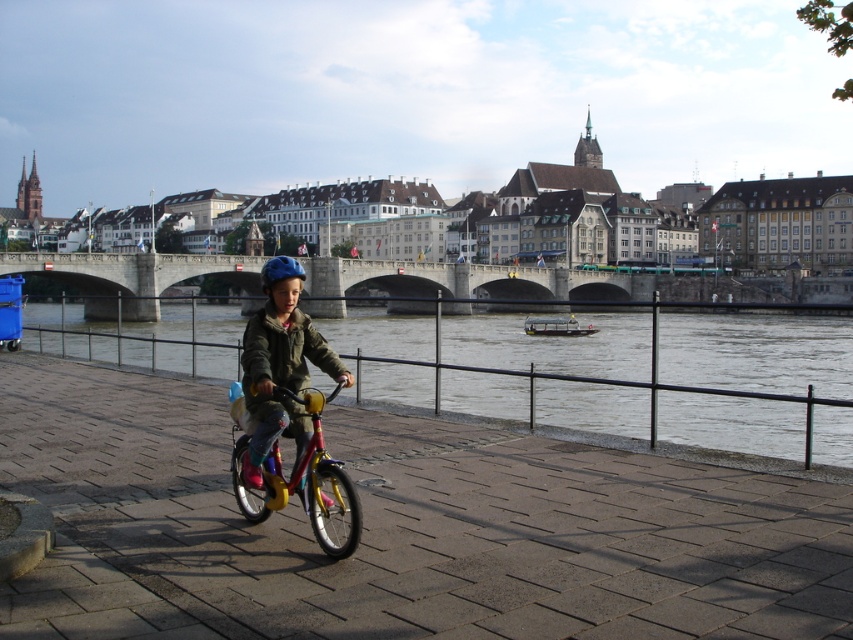
I want to click on stone bridge at center, so click(471, 285).

Who is more forward, (560, 294) or (270, 461)?

Positioned in front is point (270, 461).

Identify the location of stone bridge at center. This screenshot has width=853, height=640. (471, 285).

Consider the image. Is stone bridge at center wider than blue matte helmet at center?

Correct, the width of stone bridge at center exceeds that of blue matte helmet at center.

Is point (375, 275) farther from viewer compared to point (264, 289)?

Yes, point (375, 275) is farther from viewer.

Identify the location of stone bridge at center. Image resolution: width=853 pixels, height=640 pixels. (471, 285).

Who is positioned more to the left, smooth concrete river at center or metallic yellow bicycle at center?

From the viewer's perspective, metallic yellow bicycle at center appears more on the left side.

Is smooth concrete river at center taller than metallic yellow bicycle at center?

Indeed, smooth concrete river at center has a greater height compared to metallic yellow bicycle at center.

Which is behind, point (712, 349) or point (267, 468)?

The point (712, 349) is behind.

The height and width of the screenshot is (640, 853). What are the coordinates of `smooth concrete river at center` in the screenshot? It's located at (757, 353).